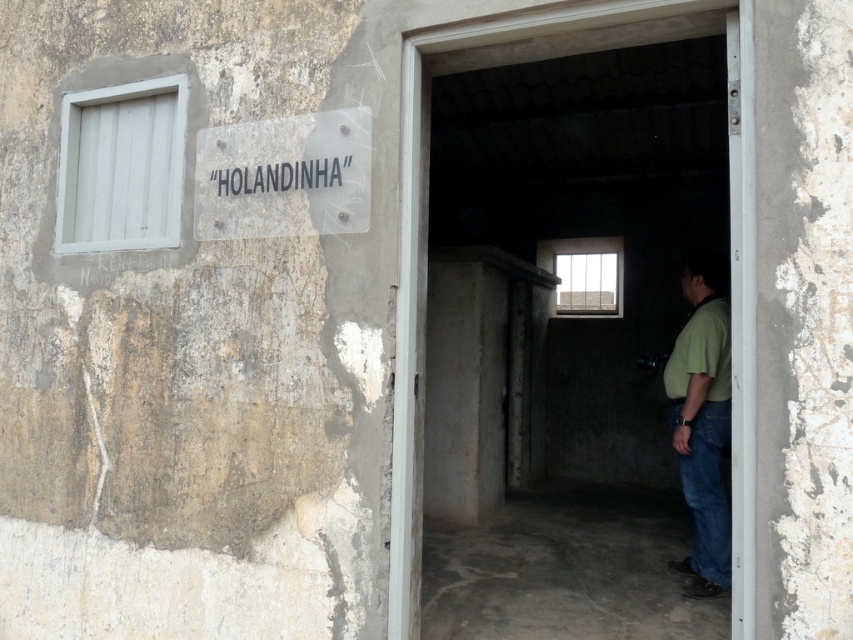
Which is more to the right, concrete door frame at center or green matte shirt at center?

green matte shirt at center is more to the right.

Can you confirm if concrete door frame at center is bigger than green matte shirt at center?

Correct, concrete door frame at center is larger in size than green matte shirt at center.

Locate an element on the screen. The image size is (853, 640). concrete door frame at center is located at coordinates (418, 230).

Identify the location of concrete door frame at center. The image size is (853, 640). (418, 230).

Who is positioned more to the right, concrete door frame at center or transparent plastic sign at upper left?

concrete door frame at center is more to the right.

Between point (688, 3) and point (285, 150), which one is positioned in front?

Point (688, 3) is more forward.

Where is `concrete door frame at center`? The image size is (853, 640). concrete door frame at center is located at coordinates (418, 230).

Does transparent plastic sign at upper left appear over green matte shirt at center?

Yes, transparent plastic sign at upper left is above green matte shirt at center.

The width and height of the screenshot is (853, 640). What do you see at coordinates (283, 177) in the screenshot?
I see `transparent plastic sign at upper left` at bounding box center [283, 177].

Where is `transparent plastic sign at upper left`? Image resolution: width=853 pixels, height=640 pixels. transparent plastic sign at upper left is located at coordinates (283, 177).